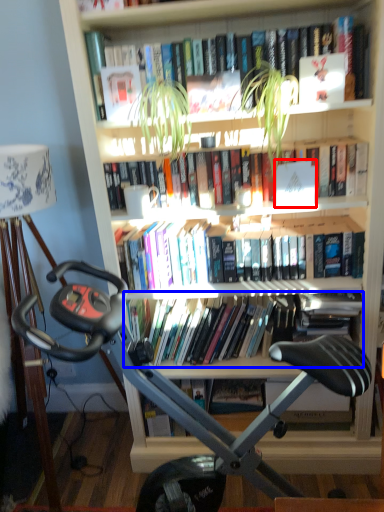
Question: Which object is further to the camera taking this photo, paperback book (highlighted by a red box) or book (highlighted by a blue box)?

Choices:
 (A) paperback book
 (B) book

Answer: (B)